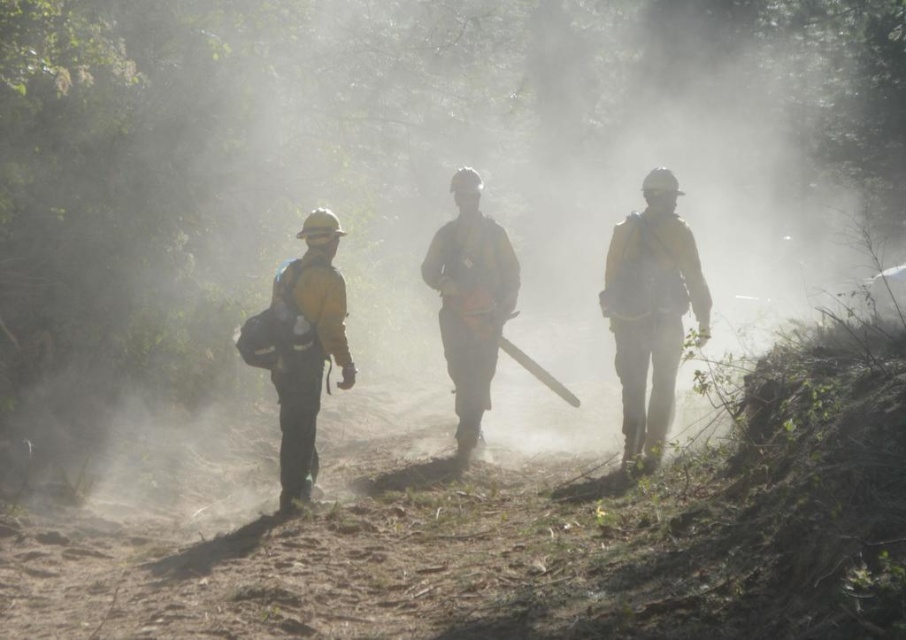
Can you confirm if yellow matte uniform at right is wider than yellow fabric chainsaw at center?

Incorrect, yellow matte uniform at right's width does not surpass yellow fabric chainsaw at center's.

Which is behind, point (651, 392) or point (480, 401)?

The point (480, 401) is more distant.

Image resolution: width=906 pixels, height=640 pixels. I want to click on yellow matte uniform at right, so tap(651, 310).

Consider the image. Between yellow matte uniform at right and yellow matte uniform at center, which one is positioned higher?

yellow matte uniform at right is higher up.

Is yellow matte uniform at right shorter than yellow matte uniform at center?

No.

Does point (633, 449) come behind point (342, 353)?

Yes, it is behind point (342, 353).

What are the coordinates of `yellow matte uniform at right` in the screenshot? It's located at (651, 310).

Does yellow fabric chainsaw at center have a larger size compared to yellow matte uniform at center?

Indeed, yellow fabric chainsaw at center has a larger size compared to yellow matte uniform at center.

Is yellow fabric chainsaw at center further to the viewer compared to yellow matte uniform at center?

Yes, yellow fabric chainsaw at center is further from the viewer.

The image size is (906, 640). What are the coordinates of `yellow fabric chainsaw at center` in the screenshot? It's located at (470, 300).

Where is `yellow fabric chainsaw at center`? Image resolution: width=906 pixels, height=640 pixels. yellow fabric chainsaw at center is located at coordinates (470, 300).